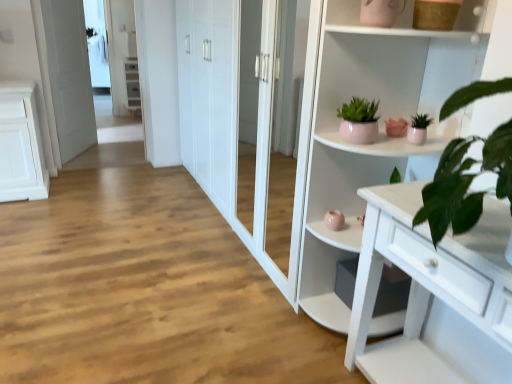
Question: Considering the positions of white glossy door at left and matte pink pot at upper center, the 1th houseplant from the left, in the image, is white glossy door at left taller or shorter than matte pink pot at upper center, the 1th houseplant from the left,?

Choices:
 (A) tall
 (B) short

Answer: (A)

Question: From the image's perspective, is white glossy door at left above or below matte pink pot at upper center, the 1th houseplant from the left?

Choices:
 (A) above
 (B) below

Answer: (A)

Question: Which object is positioned farthest from the white glossy cabinet at upper left?

Choices:
 (A) white glossy cupboard at upper right
 (B) pink ceramic houseplant at upper right, arranged as the second houseplant when viewed from the left
 (C) matte pink pot at upper center, which appears as the 2th houseplant when viewed from the right
 (D) white glossy door at left

Answer: (B)

Question: Considering the real-world distances, which object is closest to the pink ceramic houseplant at upper right, arranged as the second houseplant when viewed from the left?

Choices:
 (A) white glossy door at left
 (B) white glossy cupboard at upper right
 (C) matte pink pot at upper center, the 1th houseplant from the left
 (D) white glossy cabinet at upper left

Answer: (C)